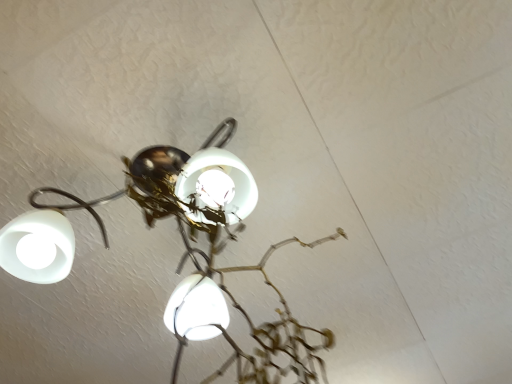
This screenshot has height=384, width=512. I want to click on white glossy lamp at upper left, so click(183, 254).

What is the approximate width of white glossy lamp at upper left?

62.07 centimeters.

Image resolution: width=512 pixels, height=384 pixels. What do you see at coordinates (183, 254) in the screenshot?
I see `white glossy lamp at upper left` at bounding box center [183, 254].

Where is `white glossy lamp at upper left`? The width and height of the screenshot is (512, 384). white glossy lamp at upper left is located at coordinates (183, 254).